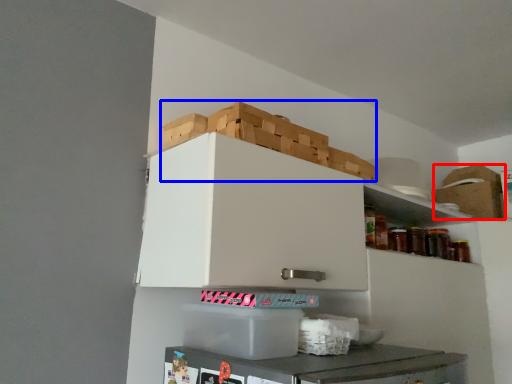
Question: Which object is further to the camera taking this photo, cardboard box (highlighted by a red box) or crate (highlighted by a blue box)?

Choices:
 (A) cardboard box
 (B) crate

Answer: (A)